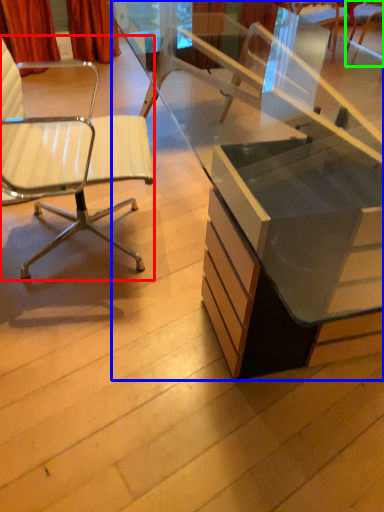
Question: Which object is the closest to the chair (highlighted by a red box)? Choose among these: desk (highlighted by a blue box) or chair (highlighted by a green box).

Choices:
 (A) desk
 (B) chair

Answer: (A)